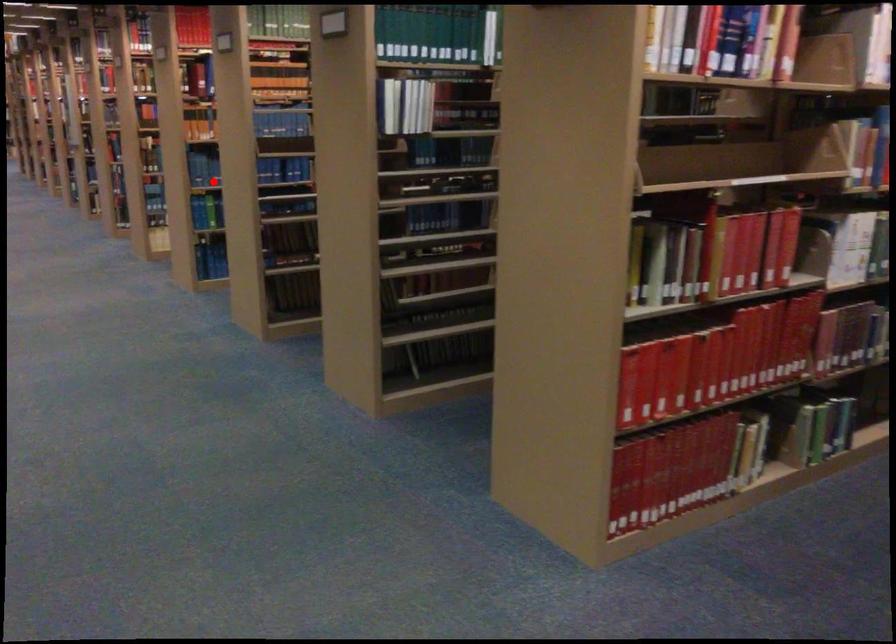
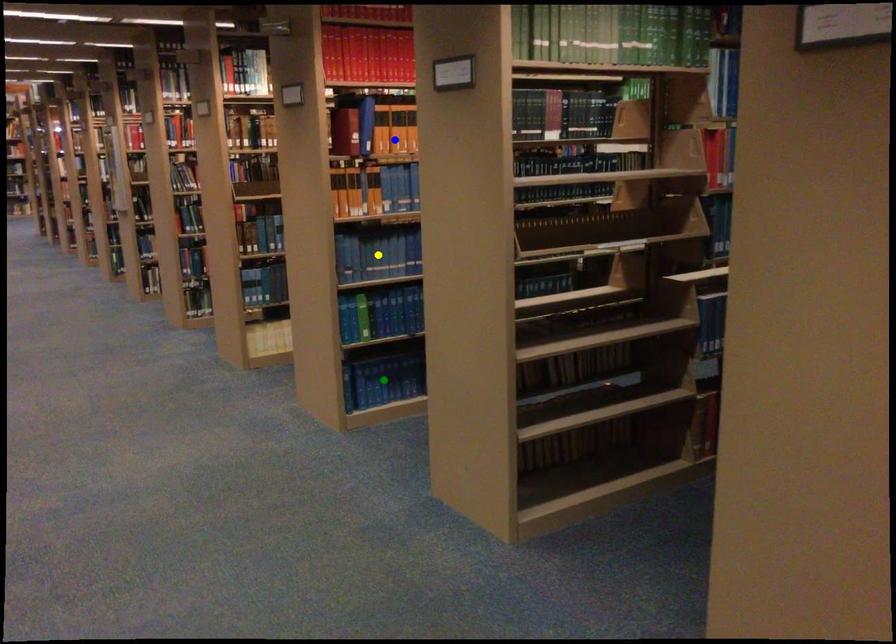
Question: I am providing you with two images of the same scene from different viewpoints. A red point is marked on the first image. You are given multiple points on the second image. Which spot in image 2 lines up with the point in image 1?

Choices:
 (A) green point
 (B) blue point
 (C) yellow point

Answer: (C)